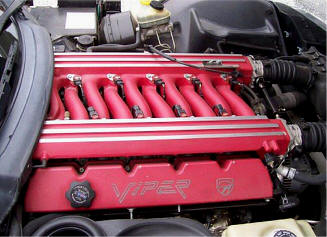
The image size is (327, 237). I want to click on cord, so click(205, 68).